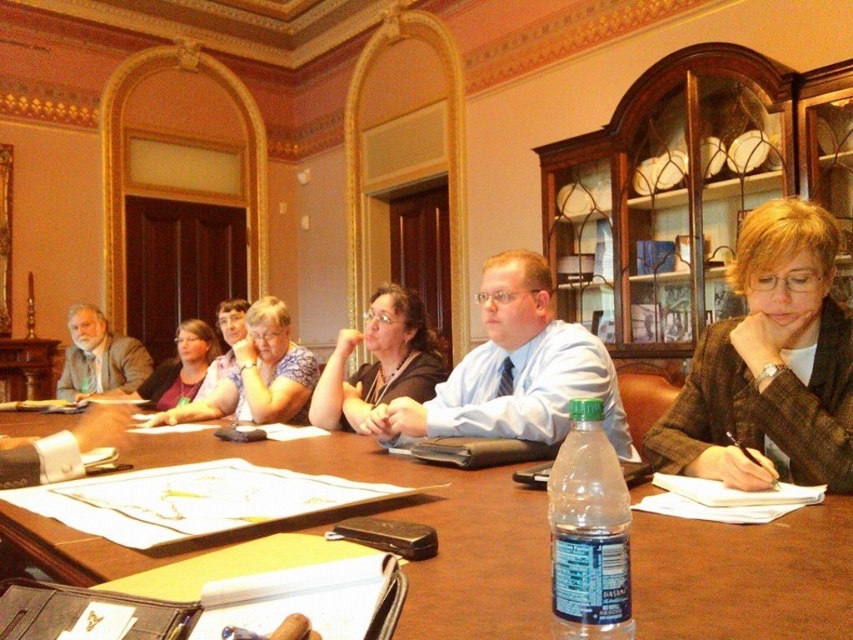
Question: Can you confirm if matte blue shirt at center is wider than floral blouse at center?

Choices:
 (A) no
 (B) yes

Answer: (B)

Question: Does brown wooden table at center have a greater width compared to matte gray suit at left?

Choices:
 (A) no
 (B) yes

Answer: (B)

Question: Which point is closer to the camera?

Choices:
 (A) (573, 582)
 (B) (514, 294)
 (C) (256, 339)
 (D) (814, 436)

Answer: (A)

Question: Does brown wooden table at center appear on the right side of matte black shirt at center?

Choices:
 (A) yes
 (B) no

Answer: (B)

Question: Which point appears farthest from the camera in this image?

Choices:
 (A) click(x=76, y=385)
 (B) click(x=578, y=600)

Answer: (A)

Question: Which point is closer to the camera?

Choices:
 (A) (125, 342)
 (B) (270, 317)
 (C) (625, 621)

Answer: (C)